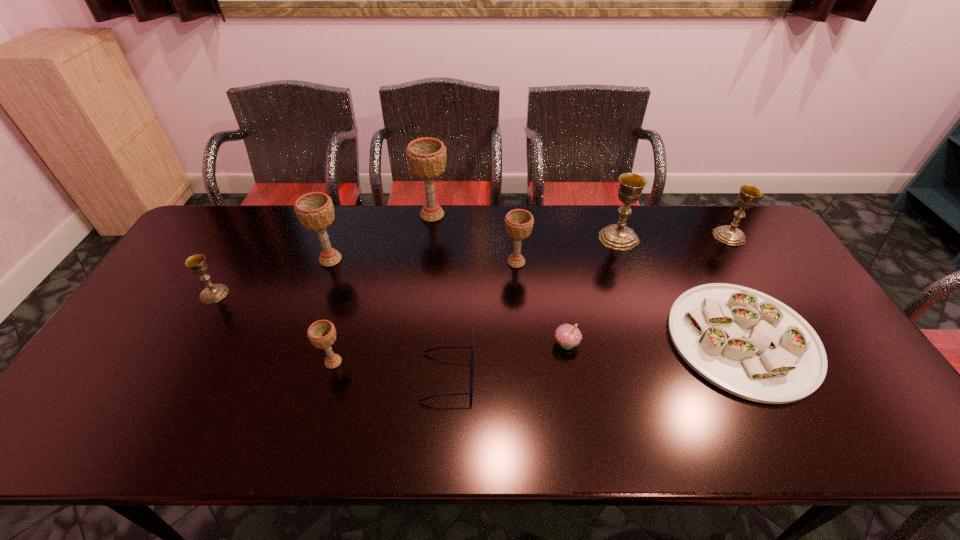
The height and width of the screenshot is (540, 960). What are the coordinates of `the tallest object` in the screenshot? It's located at (426, 157).

What are the coordinates of `the second beige chalice from right to left` in the screenshot? It's located at (426, 157).

I want to click on the second gold chalice from right to left, so click(x=618, y=236).

At what (x,y) coordinates should I click in order to perform the action: click on the biggest gold chalice. Please return your answer as a coordinate pair (x, y). This screenshot has width=960, height=540. Looking at the image, I should click on (618, 236).

You are a GUI agent. You are given a task and a screenshot of the screen. Output one action in this format:
    pyautogui.click(x=<x>, y=<y>)
    Task: Click on the second biggest beige chalice
    The image size is (960, 540).
    Given the screenshot: What is the action you would take?
    pyautogui.click(x=315, y=210)

Where is `the leftmost beige chalice`? the leftmost beige chalice is located at coordinates (315, 210).

Locate an element on the screen. the rightmost gold chalice is located at coordinates (730, 235).

Identify the location of the second smallest gold chalice. (730, 235).

Image resolution: width=960 pixels, height=540 pixels. What are the coordinates of `the second smallest beige chalice` in the screenshot? It's located at (518, 223).

Where is `the rightmost beige chalice`? the rightmost beige chalice is located at coordinates 518,223.